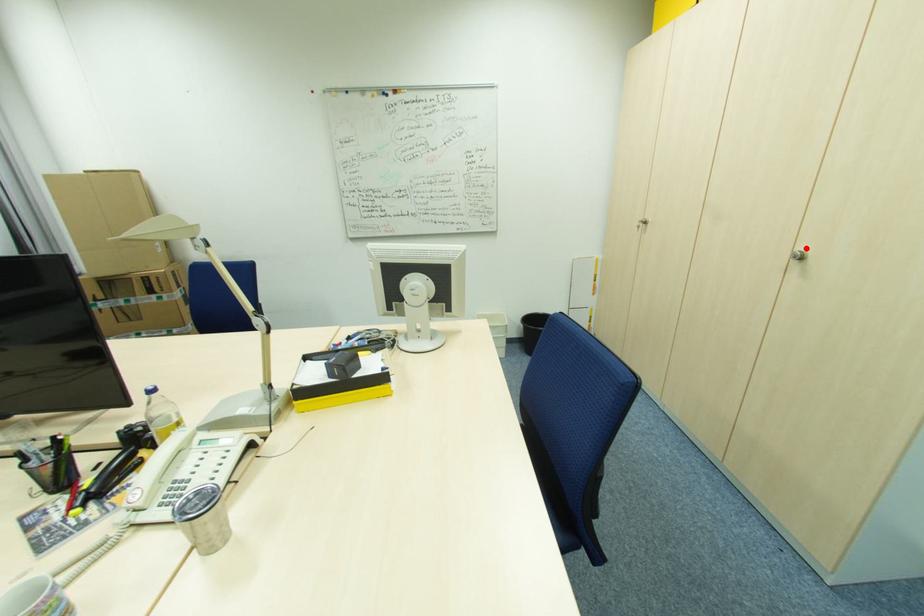
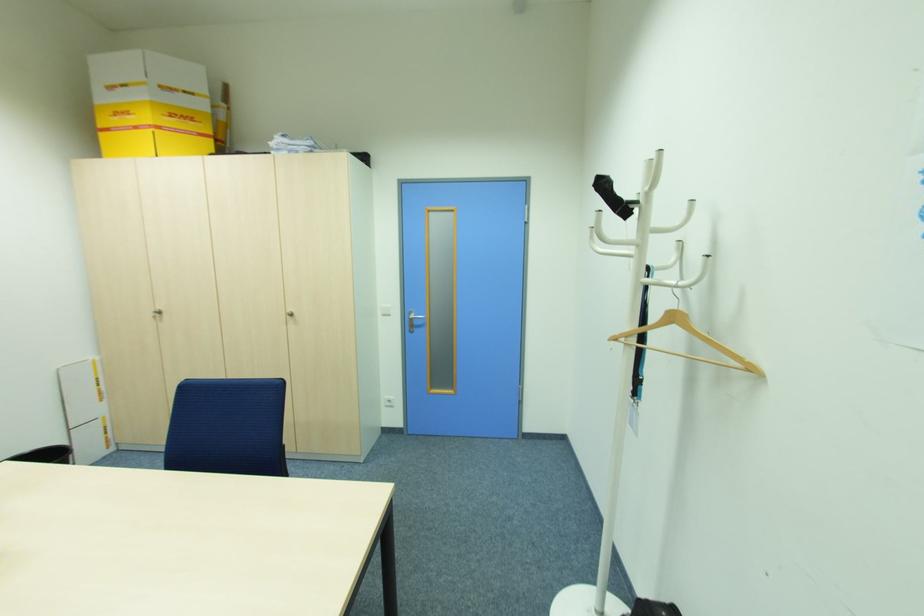
Question: I am providing you with two images of the same scene from different viewpoints. A red point is marked on the first image. Is the red point's position out of view in image 2?

Choices:
 (A) Yes
 (B) No

Answer: (B)